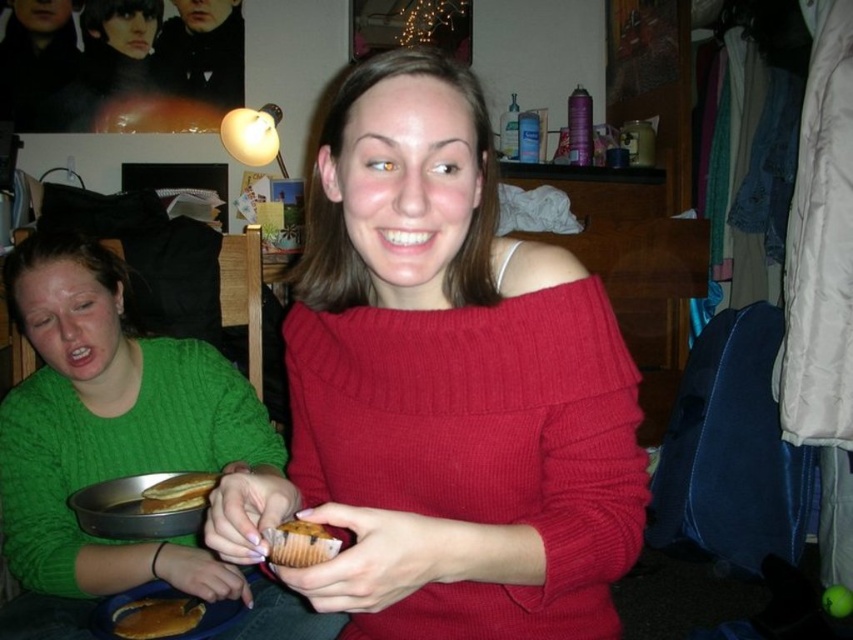
Question: Does matte red sweater at center have a smaller size compared to green knitted sweater at left?

Choices:
 (A) no
 (B) yes

Answer: (B)

Question: Which object is closer to the camera taking this photo?

Choices:
 (A) brown crumbly muffin at center
 (B) golden brown pancake at lower left
 (C) golden crispy pancakes at left
 (D) green knitted sweater at left

Answer: (A)

Question: Which point is farther to the camera?

Choices:
 (A) brown crumbly muffin at center
 (B) golden brown pancake at lower left
 (C) golden crispy pancakes at left
 (D) green knitted sweater at left

Answer: (B)

Question: Which object is closer to the camera taking this photo?

Choices:
 (A) green knitted sweater at left
 (B) golden brown pancake at lower left
 (C) matte red sweater at center
 (D) brown crumbly muffin at center

Answer: (C)

Question: Does green knitted sweater at left appear on the left side of brown crumbly muffin at center?

Choices:
 (A) yes
 (B) no

Answer: (A)

Question: Can you confirm if matte red sweater at center is thinner than brown crumbly muffin at center?

Choices:
 (A) yes
 (B) no

Answer: (B)